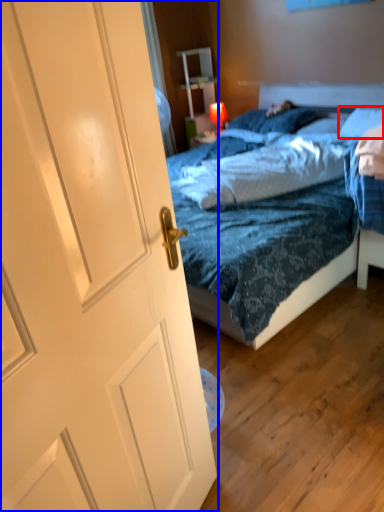
Question: Which of the following is the closest to the observer, pillow (highlighted by a red box) or door (highlighted by a blue box)?

Choices:
 (A) pillow
 (B) door

Answer: (B)